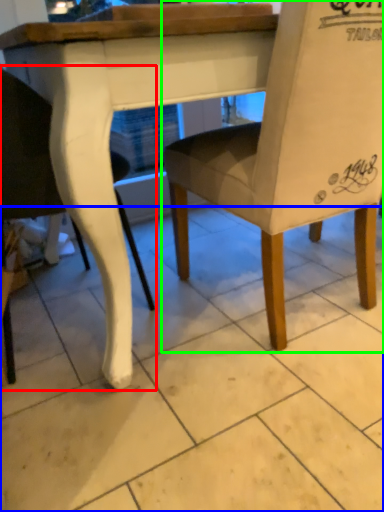
Question: Which object is positioned farthest from chair (highlighted by a red box)? Select from tile (highlighted by a blue box) and chair (highlighted by a green box).

Choices:
 (A) tile
 (B) chair

Answer: (A)